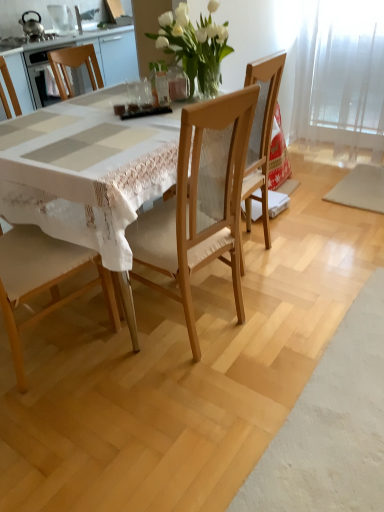
Question: Is wooden chair at center, positioned as the 2th chair in left-to-right order, in front of or behind wooden table at center in the image?

Choices:
 (A) front
 (B) behind

Answer: (B)

Question: Is point (274, 86) positioned closer to the camera than point (160, 140)?

Choices:
 (A) closer
 (B) farther

Answer: (B)

Question: Which object is the closest to the white fabric chair at left, the 1th chair when ordered from left to right?

Choices:
 (A) wooden table at center
 (B) brushed metal kettle at upper left, marked as the second appliance in a left-to-right arrangement
 (C) clear glass at center
 (D) transparent glass door at upper right
 (E) wooden chair at center, positioned as the 2th chair in left-to-right order

Answer: (A)

Question: Which is nearer to the brushed metal kettle at upper left, marked as the second appliance in a left-to-right arrangement?

Choices:
 (A) wooden chair at center, positioned as the 2th chair in left-to-right order
 (B) metallic teapot at upper left, which is counted as the 1th appliance, starting from the left
 (C) clear glass at center
 (D) wooden table at center
 (E) white glass vase at upper center

Answer: (B)